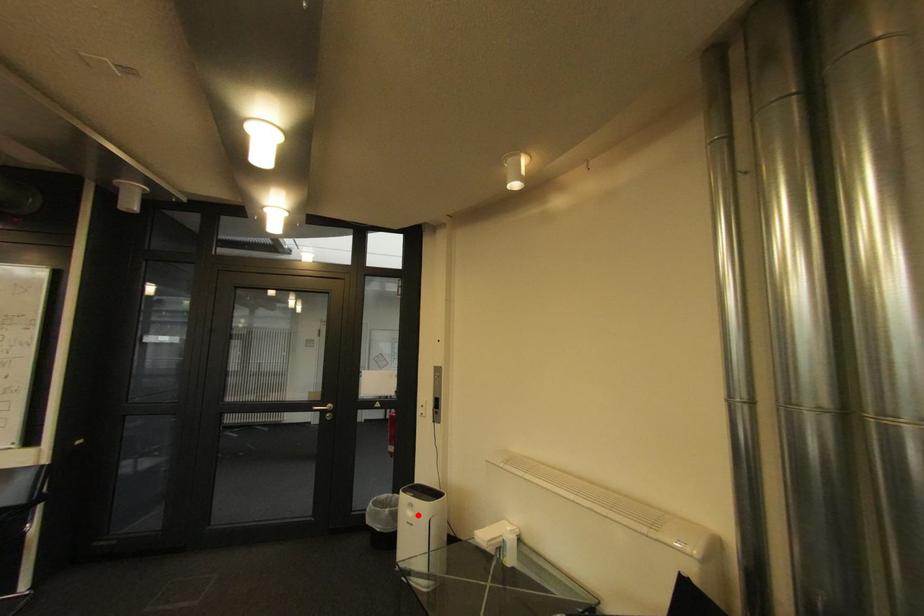
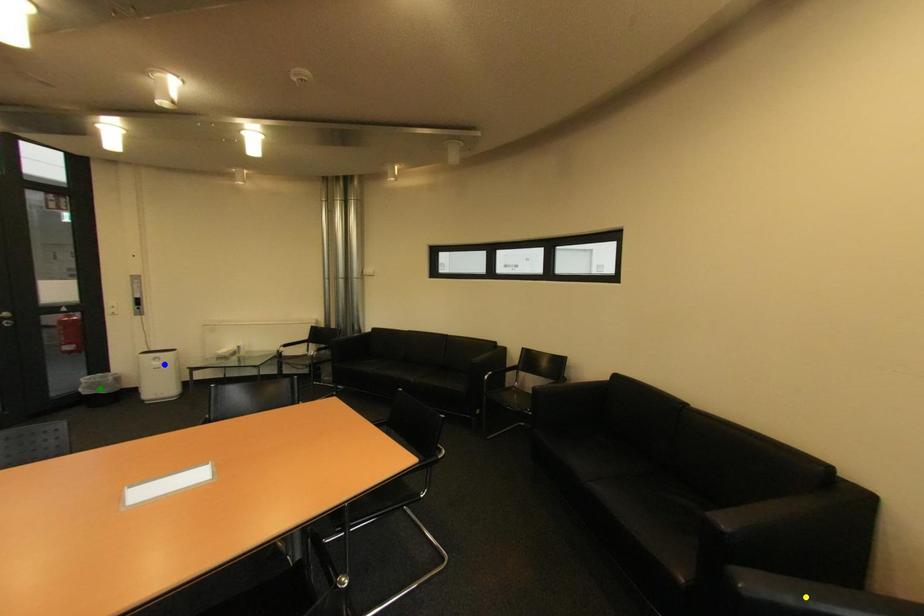
Question: I am providing you with two images of the same scene from different viewpoints. A red point is marked on the first image. You are given multiple points on the second image. Which spot in image 2 lines up with the point in image 1?

Choices:
 (A) yellow point
 (B) green point
 (C) blue point

Answer: (C)